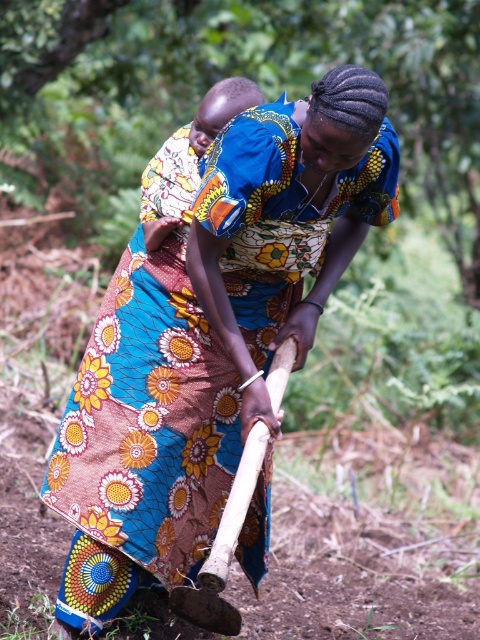
Does wooden hoe at center have a larger size compared to wooden shovel at center?

Yes.

Is wooden hoe at center to the right of wooden shovel at center from the viewer's perspective?

In fact, wooden hoe at center is to the left of wooden shovel at center.

Does point (128, 456) come farther from viewer compared to point (199, 600)?

Yes, point (128, 456) is farther from viewer.

Image resolution: width=480 pixels, height=640 pixels. I want to click on wooden hoe at center, so click(210, 336).